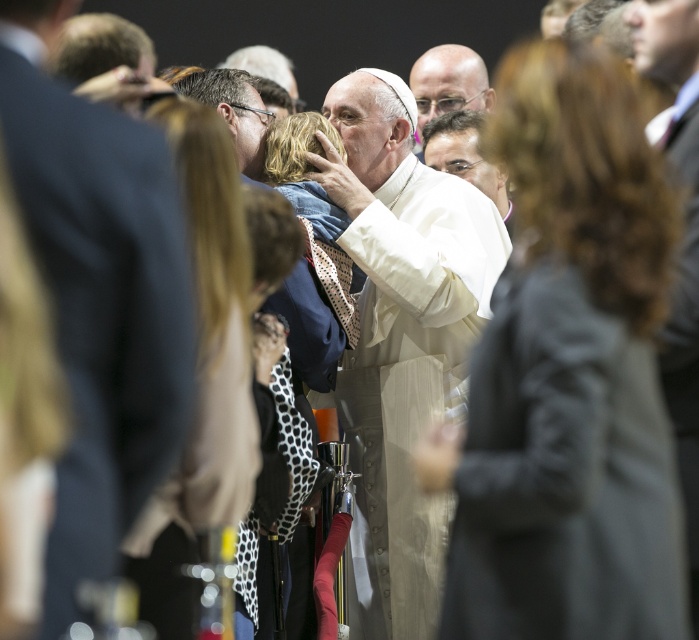
Question: Considering the relative positions of white clothed figure at center and light brown leather jacket at center in the image provided, where is white clothed figure at center located with respect to light brown leather jacket at center?

Choices:
 (A) below
 (B) above

Answer: (A)

Question: Considering the relative positions of dark gray coat at center and clear plastic glasses at upper center in the image provided, where is dark gray coat at center located with respect to clear plastic glasses at upper center?

Choices:
 (A) right
 (B) left

Answer: (A)

Question: Is dark gray coat at center to the left of polka dot fabric at center from the viewer's perspective?

Choices:
 (A) yes
 (B) no

Answer: (B)

Question: Among these points, which one is farthest from the camera?

Choices:
 (A) (426, 68)
 (B) (624, 566)
 (C) (456, 170)

Answer: (A)

Question: Which object is positioned farthest from the white clothed figure at center?

Choices:
 (A) polka dot fabric at center
 (B) dark blue suit at center
 (C) dark gray coat at center
 (D) light brown leather jacket at center

Answer: (B)

Question: Which point appears closest to the camera in this image?

Choices:
 (A) coord(503,193)
 (B) coord(324,112)

Answer: (B)